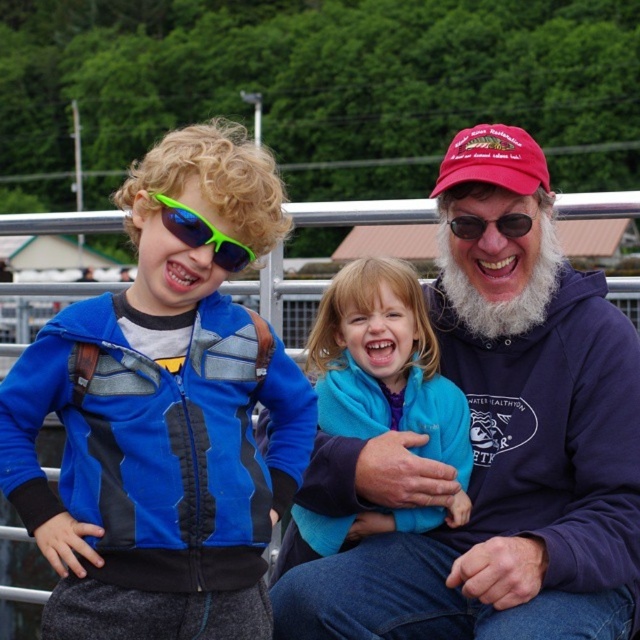
Question: Does matte blue hoodie at center appear over blue fleece jacket at center?

Choices:
 (A) yes
 (B) no

Answer: (A)

Question: Is whitewoollybeard at right below green matte sunglasses at upper center?

Choices:
 (A) yes
 (B) no

Answer: (A)

Question: Which of the following is the closest to the observer?

Choices:
 (A) green matte sunglasses at upper center
 (B) matte blue hoodie at center

Answer: (B)

Question: Which point is farther to the camera?

Choices:
 (A) matte blue hoodie at center
 (B) green matte sunglasses at upper center
 (C) matte blue jacket at left

Answer: (B)

Question: Which object is positioned closest to the whitewoollybeard at right?

Choices:
 (A) matte blue jacket at left
 (B) neon green plastic goggles at left
 (C) blue fleece jacket at center
 (D) green matte sunglasses at upper center

Answer: (D)

Question: Considering the relative positions of matte blue jacket at left and neon green plastic goggles at left in the image provided, where is matte blue jacket at left located with respect to neon green plastic goggles at left?

Choices:
 (A) below
 (B) above

Answer: (A)